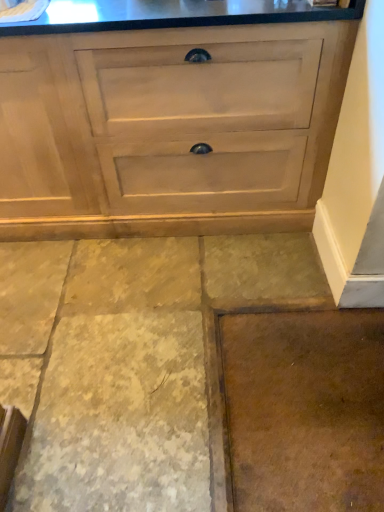
Question: From the image's perspective, is brown stone floor at lower center, which ranks as the second concrete in right-to-left order, below matte wood chest of drawers at center?

Choices:
 (A) yes
 (B) no

Answer: (A)

Question: Does brown stone floor at lower center, which ranks as the second concrete in right-to-left order, have a greater width compared to matte wood chest of drawers at center?

Choices:
 (A) yes
 (B) no

Answer: (A)

Question: From a real-world perspective, is brown stone floor at lower center, marked as the first concrete in a left-to-right arrangement, located higher than matte wood chest of drawers at center?

Choices:
 (A) yes
 (B) no

Answer: (B)

Question: Can you confirm if brown stone floor at lower center, which ranks as the second concrete in right-to-left order, is smaller than matte wood chest of drawers at center?

Choices:
 (A) no
 (B) yes

Answer: (B)

Question: Is brown stone floor at lower center, marked as the first concrete in a left-to-right arrangement, not close to matte wood chest of drawers at center?

Choices:
 (A) no
 (B) yes

Answer: (A)

Question: Is point (355, 492) positioned closer to the camera than point (223, 503)?

Choices:
 (A) closer
 (B) farther

Answer: (B)

Question: Is brown matte concrete at lower right, the 1th concrete in the right-to-left sequence, bigger or smaller than brown stone floor at lower center, marked as the first concrete in a left-to-right arrangement?

Choices:
 (A) small
 (B) big

Answer: (A)

Question: Relative to brown stone floor at lower center, which ranks as the second concrete in right-to-left order, is brown matte concrete at lower right, the second concrete from the left, in front or behind?

Choices:
 (A) behind
 (B) front

Answer: (A)

Question: In the image, is brown matte concrete at lower right, the second concrete from the left, on the left side or the right side of brown stone floor at lower center, which ranks as the second concrete in right-to-left order?

Choices:
 (A) right
 (B) left

Answer: (A)

Question: In terms of width, does brown stone floor at lower center, which ranks as the second concrete in right-to-left order, look wider or thinner when compared to brown matte concrete at lower right, the 1th concrete in the right-to-left sequence?

Choices:
 (A) wide
 (B) thin

Answer: (A)

Question: Is brown stone floor at lower center, which ranks as the second concrete in right-to-left order, situated inside brown matte concrete at lower right, the 1th concrete in the right-to-left sequence, or outside?

Choices:
 (A) outside
 (B) inside

Answer: (A)

Question: Based on their sizes in the image, would you say brown stone floor at lower center, which ranks as the second concrete in right-to-left order, is bigger or smaller than brown matte concrete at lower right, the 1th concrete in the right-to-left sequence?

Choices:
 (A) small
 (B) big

Answer: (B)

Question: Does point (71, 245) appear closer or farther from the camera than point (244, 423)?

Choices:
 (A) closer
 (B) farther

Answer: (B)

Question: Is matte wood chest of drawers at center wider or thinner than brown stone floor at lower center, which ranks as the second concrete in right-to-left order?

Choices:
 (A) wide
 (B) thin

Answer: (B)

Question: Considering the positions of matte wood chest of drawers at center and brown stone floor at lower center, marked as the first concrete in a left-to-right arrangement, in the image, is matte wood chest of drawers at center taller or shorter than brown stone floor at lower center, marked as the first concrete in a left-to-right arrangement,?

Choices:
 (A) tall
 (B) short

Answer: (A)